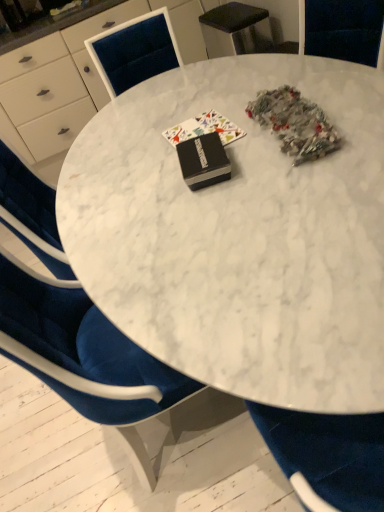
Question: Is the depth of black matte book at center, which ranks as the second book in back-to-front order, greater than that of black matte book at center, which appears as the first book when viewed from the back?

Choices:
 (A) no
 (B) yes

Answer: (A)

Question: Is black matte book at center, placed as the 1th book when sorted from front to back, touching black matte book at center, which appears as the first book when viewed from the back?

Choices:
 (A) no
 (B) yes

Answer: (A)

Question: Is black matte book at center, placed as the 1th book when sorted from front to back, closer to camera compared to black matte book at center, which appears as the first book when viewed from the back?

Choices:
 (A) no
 (B) yes

Answer: (B)

Question: Can black matte book at center, which appears as the first book when viewed from the back, be found inside black matte book at center, placed as the 1th book when sorted from front to back?

Choices:
 (A) yes
 (B) no

Answer: (B)

Question: Is black matte book at center, which ranks as the second book in back-to-front order, located outside black matte book at center, which is counted as the 2th book, starting from the front?

Choices:
 (A) yes
 (B) no

Answer: (A)

Question: From the image's perspective, is black matte book at center, which ranks as the second book in back-to-front order, over black matte book at center, which is counted as the 2th book, starting from the front?

Choices:
 (A) no
 (B) yes

Answer: (A)

Question: Is black matte book at center, which appears as the first book when viewed from the back, facing towards black matte book at center, placed as the 1th book when sorted from front to back?

Choices:
 (A) no
 (B) yes

Answer: (B)

Question: Considering the relative positions of black matte book at center, which is counted as the 2th book, starting from the front, and black matte book at center, which ranks as the second book in back-to-front order, in the image provided, is black matte book at center, which is counted as the 2th book, starting from the front, to the right of black matte book at center, which ranks as the second book in back-to-front order, from the viewer's perspective?

Choices:
 (A) yes
 (B) no

Answer: (B)

Question: From the image's perspective, is black matte book at center, which appears as the first book when viewed from the back, under black matte book at center, which ranks as the second book in back-to-front order?

Choices:
 (A) no
 (B) yes

Answer: (A)

Question: From a real-world perspective, is black matte book at center, which is counted as the 2th book, starting from the front, on black matte book at center, placed as the 1th book when sorted from front to back?

Choices:
 (A) no
 (B) yes

Answer: (A)

Question: Are black matte book at center, which is counted as the 2th book, starting from the front, and black matte book at center, which ranks as the second book in back-to-front order, far apart?

Choices:
 (A) yes
 (B) no

Answer: (B)

Question: Considering the relative sizes of black matte book at center, which is counted as the 2th book, starting from the front, and black matte book at center, which ranks as the second book in back-to-front order, in the image provided, is black matte book at center, which is counted as the 2th book, starting from the front, taller than black matte book at center, which ranks as the second book in back-to-front order,?

Choices:
 (A) no
 (B) yes

Answer: (A)

Question: From a real-world perspective, is black matte book at center, which appears as the first book when viewed from the back, under white marble table at center?

Choices:
 (A) no
 (B) yes

Answer: (A)